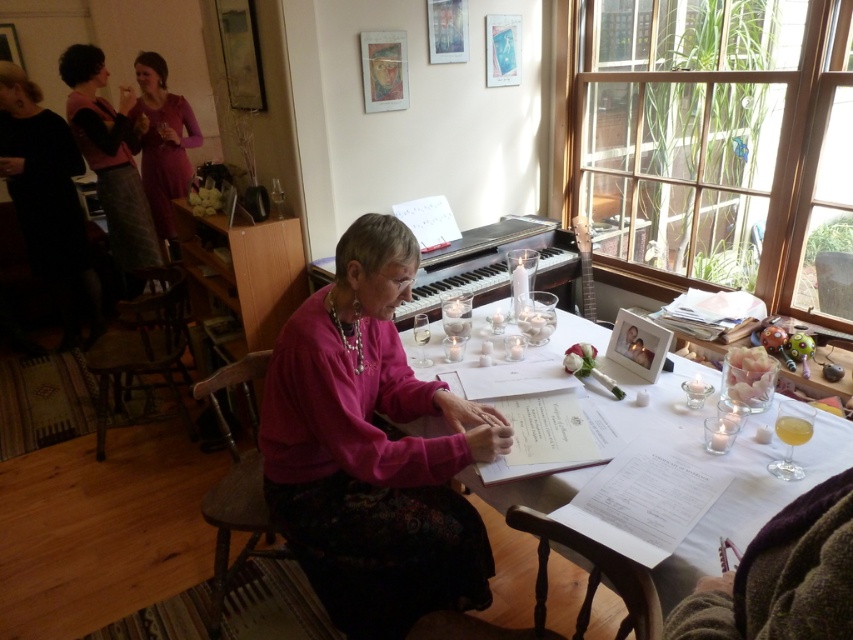
Question: Which of these objects is positioned closest to the pink fabric at center?

Choices:
 (A) white paper at center
 (B) matte pink dress at upper left
 (C) black dress at left
 (D) black polished piano at center

Answer: (A)

Question: Which of these objects is positioned farthest from the white paper at center?

Choices:
 (A) black polished piano at center
 (B) pink fabric at center

Answer: (A)

Question: Which point is farther to the camera?

Choices:
 (A) (65, 221)
 (B) (352, 435)

Answer: (A)

Question: Is matte pink sweater at upper left in front of matte pink dress at upper left?

Choices:
 (A) yes
 (B) no

Answer: (A)

Question: Can you confirm if black dress at left is bigger than black polished piano at center?

Choices:
 (A) yes
 (B) no

Answer: (A)

Question: From the image, what is the correct spatial relationship of white paper at center in relation to matte pink sweater at upper left?

Choices:
 (A) below
 (B) above

Answer: (A)